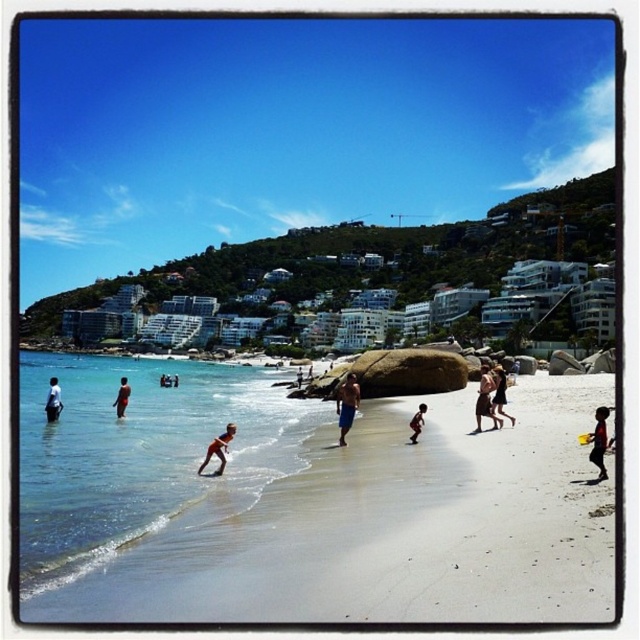
Does smooth sand beach at lower center have a greater width compared to matte black shorts at left?

Yes, smooth sand beach at lower center is wider than matte black shorts at left.

Does smooth sand beach at lower center have a larger size compared to matte black shorts at left?

Yes.

What are the coordinates of `smooth sand beach at lower center` in the screenshot? It's located at (308, 506).

Which is below, smooth sand beach at lower center or tan skin person at lower center?

tan skin person at lower center is lower down.

What do you see at coordinates (308, 506) in the screenshot? I see `smooth sand beach at lower center` at bounding box center [308, 506].

In order to click on smooth sand beach at lower center in this screenshot , I will do `click(308, 506)`.

Measure the distance between blue denim shorts at center and smooth tan skin at center.

A distance of 17.33 meters exists between blue denim shorts at center and smooth tan skin at center.

Which is behind, point (344, 413) or point (480, 384)?

The point (480, 384) is behind.

This screenshot has height=640, width=640. I want to click on blue denim shorts at center, so click(346, 404).